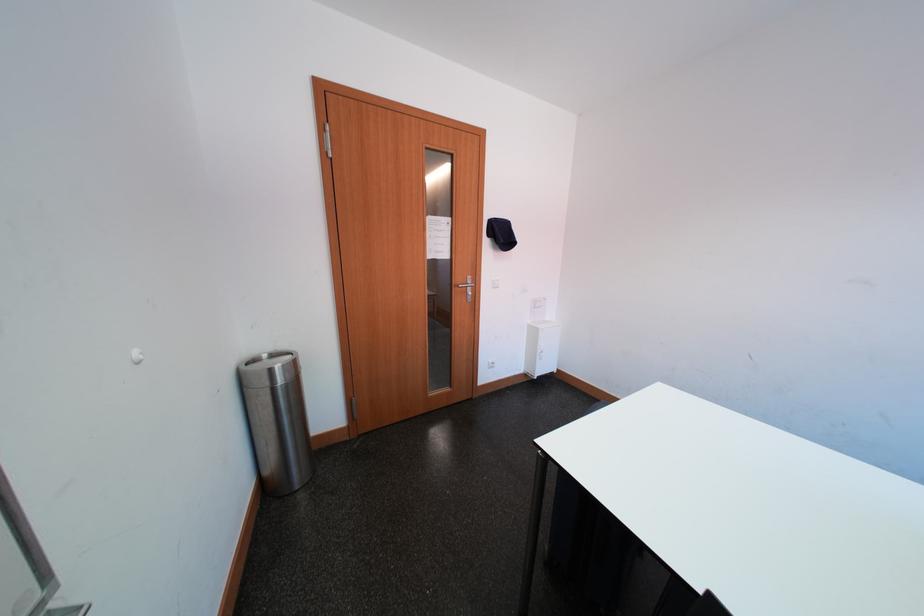
Find where to pull the metal door handle. Please return your answer as a coordinate pair (x, y).

(467, 286)